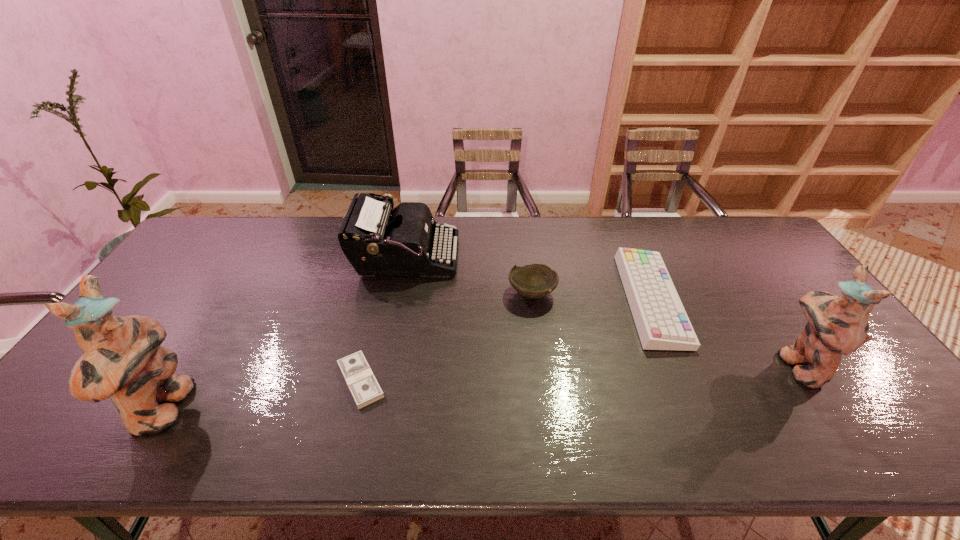
Where is `vacant region located 0.170m on the front-facing side of the tallest object`? The height and width of the screenshot is (540, 960). vacant region located 0.170m on the front-facing side of the tallest object is located at coordinates (261, 410).

Locate an element on the screen. The width and height of the screenshot is (960, 540). vacant region located 0.110m on the front-facing side of the second tallest object is located at coordinates (737, 365).

What are the coordinates of `free space located on the front-facing side of the second tallest object` in the screenshot? It's located at (730, 365).

The image size is (960, 540). Identify the location of vacant space located on the front-facing side of the second tallest object. (663, 365).

At what (x,y) coordinates should I click in order to perform the action: click on vacant space located 0.210m on the typing side of the typewriter. Please return your answer as a coordinate pair (x, y). Looking at the image, I should click on (520, 258).

Find the location of `vacant space located on the right of the fourth object from left to right`. vacant space located on the right of the fourth object from left to right is located at coordinates (592, 293).

At what (x,y) coordinates should I click in order to perform the action: click on vacant space located on the left of the computer keyboard. Please return your answer as a coordinate pair (x, y). Looking at the image, I should click on (588, 300).

You are a GUI agent. You are given a task and a screenshot of the screen. Output one action in this format:
    pyautogui.click(x=<x>, y=<y>)
    Task: Click on the vacant space located on the right of the shortest object
    The height and width of the screenshot is (540, 960).
    Given the screenshot: What is the action you would take?
    pyautogui.click(x=516, y=380)

Where is `object at the far edge`? The image size is (960, 540). object at the far edge is located at coordinates (378, 241).

What are the coordinates of `dollar that is at the near edge` in the screenshot? It's located at (356, 371).